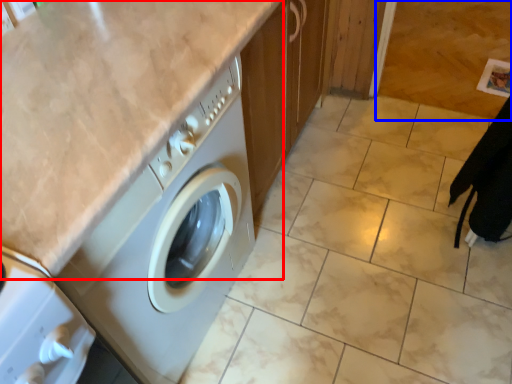
Question: Which point is closer to the camera, counter top (highlighted by a red box) or granite (highlighted by a blue box)?

Choices:
 (A) counter top
 (B) granite

Answer: (A)